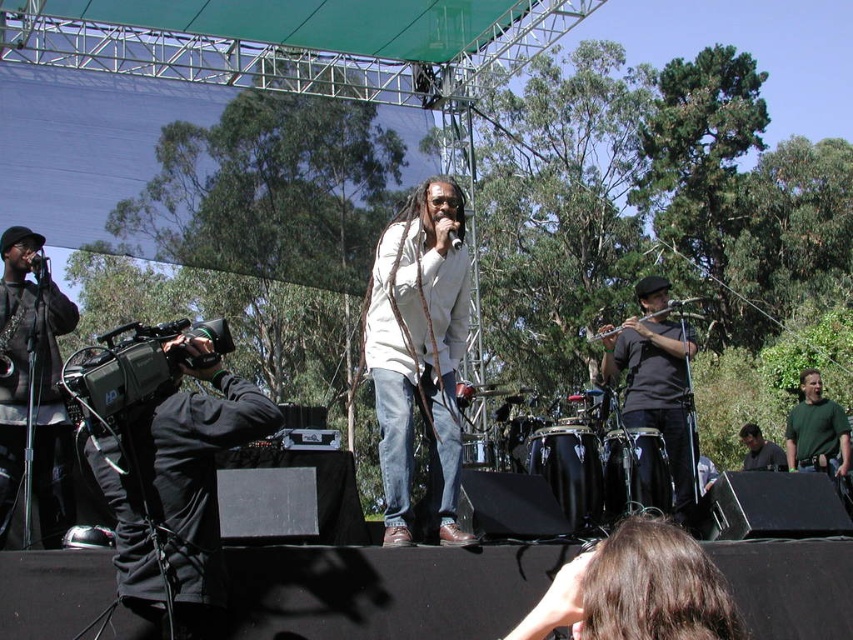
Can you confirm if green matte shirt at right is positioned to the left of green matte shirt at center?

No, green matte shirt at right is not to the left of green matte shirt at center.

Is green matte shirt at right to the right of green matte shirt at center from the viewer's perspective?

Correct, you'll find green matte shirt at right to the right of green matte shirt at center.

Where is `green matte shirt at right`? The image size is (853, 640). green matte shirt at right is located at coordinates (816, 429).

Image resolution: width=853 pixels, height=640 pixels. In order to click on green matte shirt at right in this screenshot , I will do click(816, 429).

Which is in front, point (648, 420) or point (808, 468)?

Point (648, 420) is more forward.

Describe the element at coordinates (656, 381) in the screenshot. This screenshot has height=640, width=853. I see `black matte shirt at right` at that location.

The height and width of the screenshot is (640, 853). I want to click on black matte shirt at right, so click(656, 381).

Measure the distance between black matte camera at left and green matte shirt at center.

black matte camera at left is 23.84 meters away from green matte shirt at center.

Which is more to the left, black matte camera at left or green matte shirt at center?

Positioned to the left is black matte camera at left.

I want to click on black matte camera at left, so click(x=167, y=464).